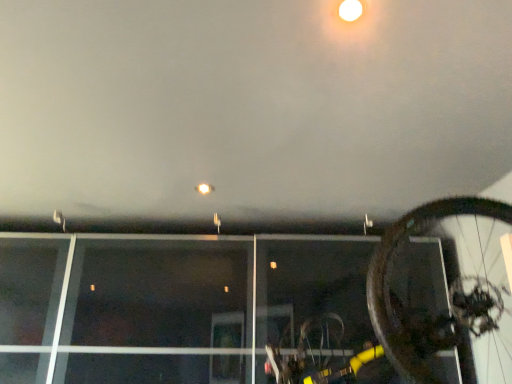
Question: In terms of width, does shiny metallic bicycle wheel at right look wider or thinner when compared to matte white droplight at upper center?

Choices:
 (A) thin
 (B) wide

Answer: (B)

Question: In the image, is shiny metallic bicycle wheel at right on the left side or the right side of matte white droplight at upper center?

Choices:
 (A) right
 (B) left

Answer: (A)

Question: Looking at the image, does shiny metallic bicycle wheel at right seem bigger or smaller compared to matte white droplight at upper center?

Choices:
 (A) big
 (B) small

Answer: (A)

Question: Based on their positions, is matte white droplight at upper center located to the left or right of shiny metallic bicycle wheel at right?

Choices:
 (A) left
 (B) right

Answer: (A)

Question: Considering the positions of matte white droplight at upper center and shiny metallic bicycle wheel at right in the image, is matte white droplight at upper center wider or thinner than shiny metallic bicycle wheel at right?

Choices:
 (A) thin
 (B) wide

Answer: (A)

Question: Based on their sizes in the image, would you say matte white droplight at upper center is bigger or smaller than shiny metallic bicycle wheel at right?

Choices:
 (A) small
 (B) big

Answer: (A)

Question: From their relative heights in the image, would you say matte white droplight at upper center is taller or shorter than shiny metallic bicycle wheel at right?

Choices:
 (A) short
 (B) tall

Answer: (A)